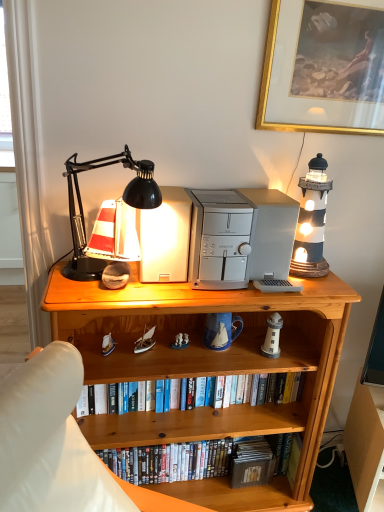
Question: Should I look upward or downward to see gold-framed painting at upper right?

Choices:
 (A) down
 (B) up

Answer: (B)

Question: Does black matte desk lamp at upper left have a larger size compared to silver metallic desktop computer at center, the second appliance from the left?

Choices:
 (A) yes
 (B) no

Answer: (A)

Question: Can you confirm if black matte desk lamp at upper left is positioned to the right of silver metallic desktop computer at center, acting as the 1th appliance starting from the right?

Choices:
 (A) yes
 (B) no

Answer: (B)

Question: Can you confirm if black matte desk lamp at upper left is smaller than silver metallic desktop computer at center, the second appliance from the left?

Choices:
 (A) yes
 (B) no

Answer: (B)

Question: Is black matte desk lamp at upper left facing away from silver metallic desktop computer at center, the second appliance from the left?

Choices:
 (A) yes
 (B) no

Answer: (B)

Question: Are black matte desk lamp at upper left and silver metallic desktop computer at center, acting as the 1th appliance starting from the right, located far from each other?

Choices:
 (A) no
 (B) yes

Answer: (A)

Question: Is silver metallic desktop computer at center, the second appliance from the left, inside black matte desk lamp at upper left?

Choices:
 (A) no
 (B) yes

Answer: (A)

Question: From the image's perspective, is black matte desk lamp at upper left located above white fabric curtain at left?

Choices:
 (A) yes
 (B) no

Answer: (B)

Question: From a real-world perspective, is black matte desk lamp at upper left under white fabric curtain at left?

Choices:
 (A) yes
 (B) no

Answer: (B)

Question: Is black matte desk lamp at upper left positioned far away from white fabric curtain at left?

Choices:
 (A) no
 (B) yes

Answer: (A)

Question: Are black matte desk lamp at upper left and white fabric curtain at left beside each other?

Choices:
 (A) yes
 (B) no

Answer: (B)

Question: Is black matte desk lamp at upper left looking in the opposite direction of white fabric curtain at left?

Choices:
 (A) no
 (B) yes

Answer: (A)

Question: Is black matte desk lamp at upper left to the left of white fabric curtain at left from the viewer's perspective?

Choices:
 (A) no
 (B) yes

Answer: (A)

Question: Is white fabric curtain at left completely or partially outside of wooden bookcase at center?

Choices:
 (A) no
 (B) yes

Answer: (B)